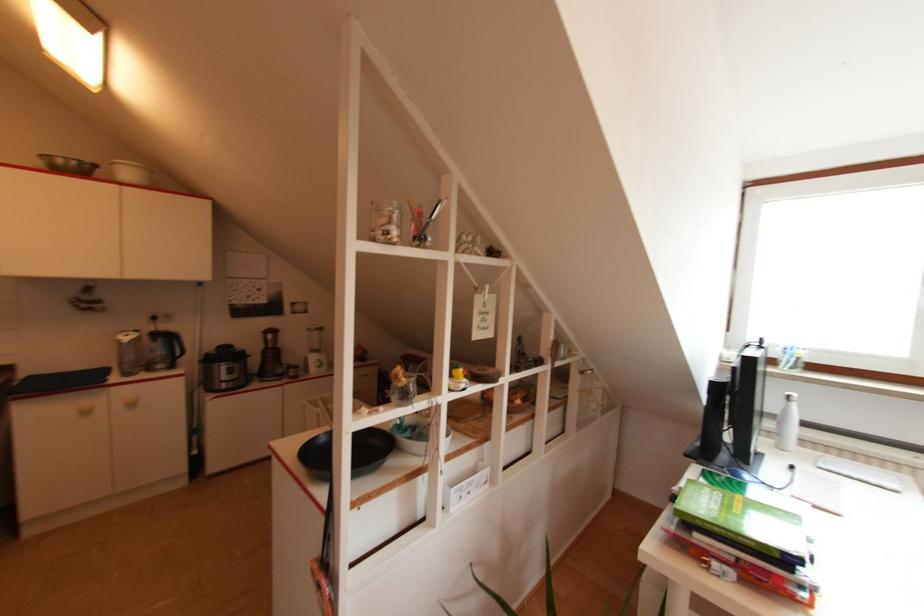
Image resolution: width=924 pixels, height=616 pixels. I want to click on cooker lid handle, so click(x=222, y=350).